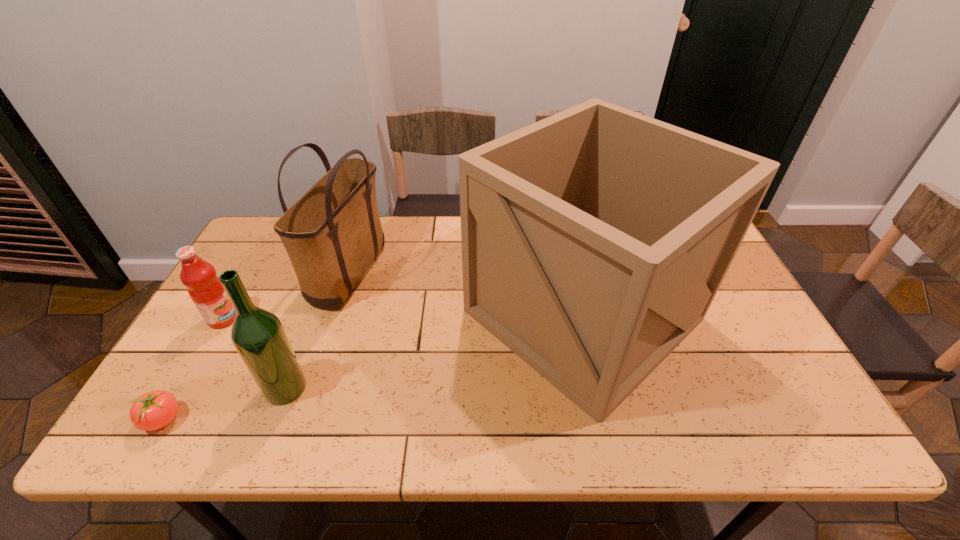
In order to click on object located in the near right corner section of the desktop in this screenshot , I will do `click(594, 241)`.

I want to click on vacant space at the far edge, so click(391, 236).

The image size is (960, 540). I want to click on free region at the near edge of the desktop, so click(x=662, y=418).

At what (x,y) coordinates should I click in order to perform the action: click on vacant space at the right edge. Please return your answer as a coordinate pair (x, y). Looking at the image, I should click on (731, 382).

Find the location of a particular element. free area in between the shortest object and the alcohol is located at coordinates (224, 404).

At what (x,y) coordinates should I click in order to perform the action: click on free spot between the alcohol and the shortest object. Please return your answer as a coordinate pair (x, y). Looking at the image, I should click on (224, 404).

Image resolution: width=960 pixels, height=540 pixels. I want to click on vacant region between the box and the second shortest object, so click(x=403, y=316).

What are the coordinates of `free space between the tomato and the rightmost object` in the screenshot? It's located at (372, 367).

Image resolution: width=960 pixels, height=540 pixels. I want to click on vacant area that lies between the fourth tallest object and the tomato, so click(x=193, y=369).

Point out which object is positioned as the nearest to the tote bag. Please provide its 2D coordinates. Your answer should be formatted as a tuple, i.e. [(x, y)], where the tuple contains the x and y coordinates of a point satisfying the conditions above.

[(204, 287)]